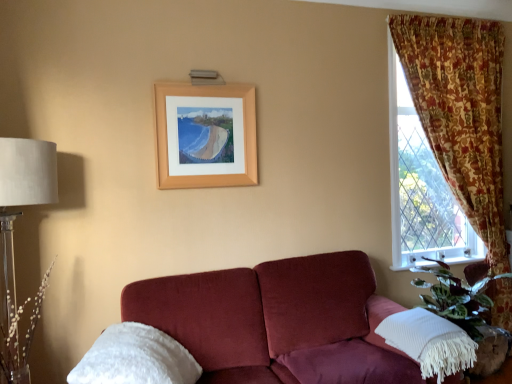
Question: Does white textured pillow at lower right, arranged as the 2th pillow when viewed from the left, have a larger size compared to white plastic at lower right?

Choices:
 (A) yes
 (B) no

Answer: (A)

Question: Does white textured pillow at lower right, acting as the 1th pillow starting from the right, lie in front of white plastic at lower right?

Choices:
 (A) no
 (B) yes

Answer: (B)

Question: Does white textured pillow at lower right, arranged as the 2th pillow when viewed from the left, have a greater height compared to white plastic at lower right?

Choices:
 (A) yes
 (B) no

Answer: (A)

Question: Is white textured pillow at lower right, arranged as the 2th pillow when viewed from the left, facing away from white plastic at lower right?

Choices:
 (A) yes
 (B) no

Answer: (B)

Question: Is white textured pillow at lower right, acting as the 1th pillow starting from the right, outside of white plastic at lower right?

Choices:
 (A) yes
 (B) no

Answer: (A)

Question: From the image's perspective, is white textured pillow at lower right, acting as the 1th pillow starting from the right, over white plastic at lower right?

Choices:
 (A) no
 (B) yes

Answer: (A)

Question: Are white fluffy pillow at lower left, which appears as the 1th pillow when viewed from the left, and translucent glass table lamp at left located far from each other?

Choices:
 (A) yes
 (B) no

Answer: (B)

Question: Is white fluffy pillow at lower left, marked as the 2th pillow in a right-to-left arrangement, outside translucent glass table lamp at left?

Choices:
 (A) yes
 (B) no

Answer: (A)

Question: Is white fluffy pillow at lower left, marked as the 2th pillow in a right-to-left arrangement, to the left of translucent glass table lamp at left from the viewer's perspective?

Choices:
 (A) no
 (B) yes

Answer: (A)

Question: From a real-world perspective, is white fluffy pillow at lower left, marked as the 2th pillow in a right-to-left arrangement, positioned over translucent glass table lamp at left based on gravity?

Choices:
 (A) yes
 (B) no

Answer: (B)

Question: Does white fluffy pillow at lower left, which appears as the 1th pillow when viewed from the left, have a greater height compared to translucent glass table lamp at left?

Choices:
 (A) no
 (B) yes

Answer: (A)

Question: From a real-world perspective, is white fluffy pillow at lower left, which appears as the 1th pillow when viewed from the left, beneath translucent glass table lamp at left?

Choices:
 (A) no
 (B) yes

Answer: (B)

Question: Considering the relative positions of white fluffy pillow at lower left, marked as the 2th pillow in a right-to-left arrangement, and floral fabric curtain at right in the image provided, is white fluffy pillow at lower left, marked as the 2th pillow in a right-to-left arrangement, behind floral fabric curtain at right?

Choices:
 (A) no
 (B) yes

Answer: (A)